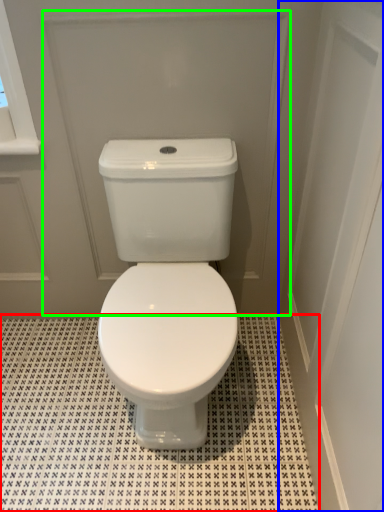
Question: Considering the real-world distances, which object is closest to tile (highlighted by a red box)? screen door (highlighted by a blue box) or screen door (highlighted by a green box).

Choices:
 (A) screen door
 (B) screen door

Answer: (A)